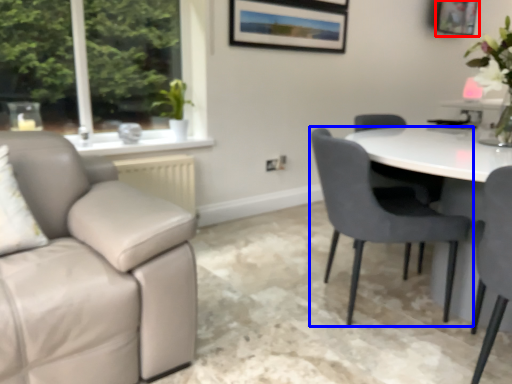
Question: Which point is further to the camera, picture frame (highlighted by a red box) or chair (highlighted by a blue box)?

Choices:
 (A) picture frame
 (B) chair

Answer: (A)